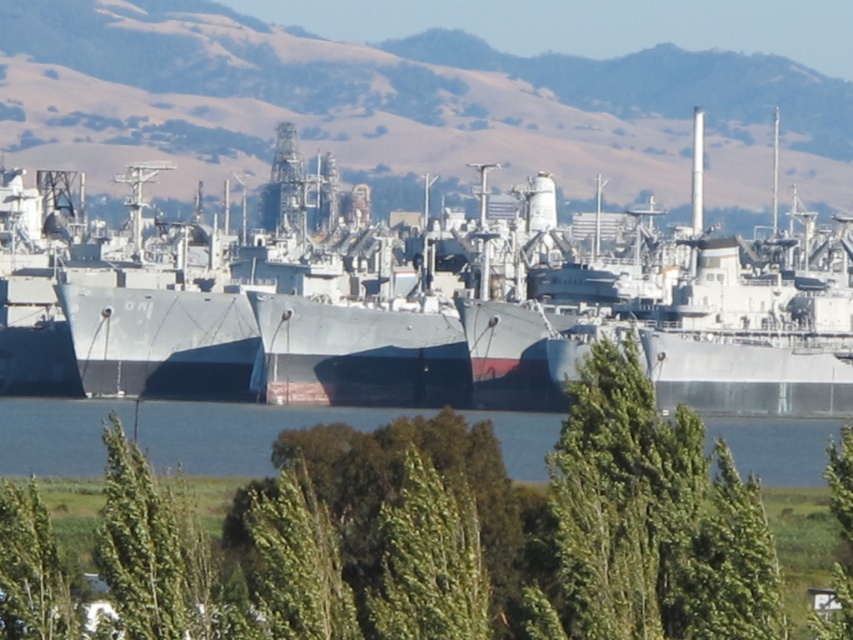
Question: Which of the following is the farthest from the observer?

Choices:
 (A) (850, 340)
 (B) (258, 474)
 (C) (492, 611)

Answer: (A)

Question: Which point is closer to the camera taking this photo?

Choices:
 (A) (183, 426)
 (B) (514, 515)

Answer: (B)

Question: Does green leafy tree at center have a smaller size compared to blue water at center?

Choices:
 (A) yes
 (B) no

Answer: (B)

Question: Among these points, which one is farthest from the camera?

Choices:
 (A) (154, 372)
 (B) (202, 429)
 (C) (270, 586)

Answer: (A)

Question: Does metallic gray ship at center appear on the left side of blue water at center?

Choices:
 (A) no
 (B) yes

Answer: (A)

Question: Is green leafy tree at center thinner than blue water at center?

Choices:
 (A) yes
 (B) no

Answer: (A)